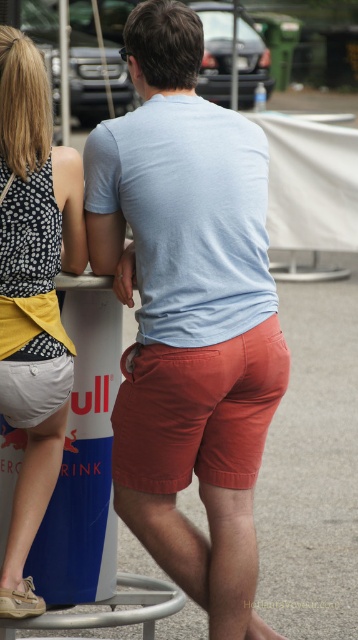
You are standing at the back of the scene and need to reach the metallic pole at upper left. There is a polka dot fabric dress at upper left in your way. Can you walk straight to the pole without going around?

The polka dot fabric dress at upper left is 11.10 meters away from the metallic pole at upper left. Since the distance between them is quite large, you can walk straight to the metallic pole at upper left without needing to go around the dress.